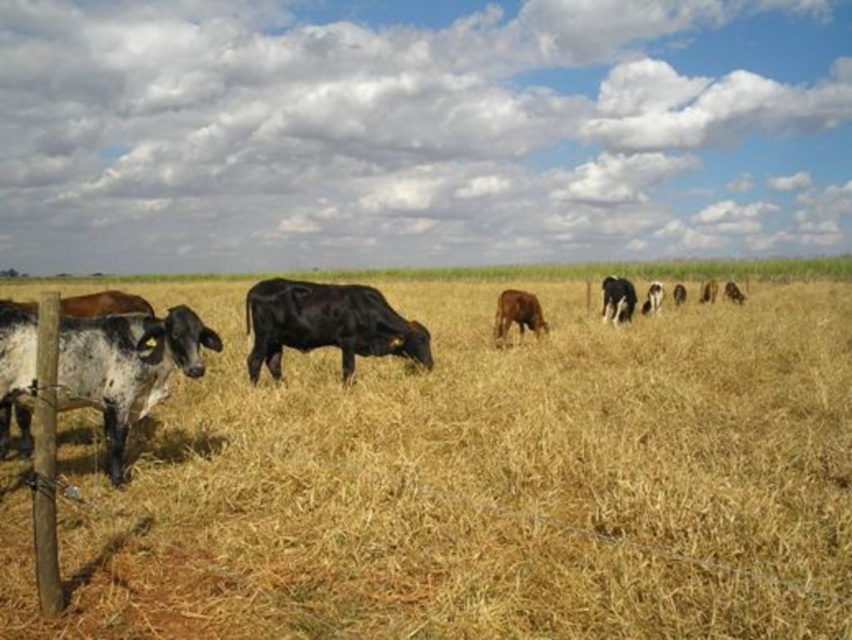
You are a farmer checking the field. You see the dry straw at center and the black smooth cow at center. Which one is wider?

The dry straw at center might be wider than black smooth cow at center.

You are standing in the field and want to walk to the cow near the wooden fence. Which point, point (602,618) or point (401,349), is closer to your starting position?

Point (602,618) is closer to the viewer than point (401,349), so you should head towards point (602,618) as it is nearer to your current position.

You are standing in the field and want to walk from point (709, 314) to point (528, 312). Which direction should you face to move towards the destination?

Point (709, 314) is further to the viewer than point (528, 312). To move towards the destination, you should face away from the viewer, which would be towards the direction of the middle ground where the other cows are scattered.